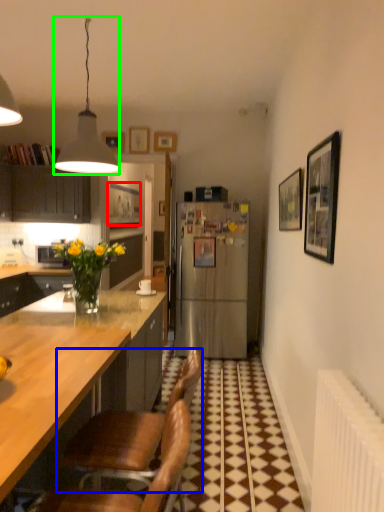
Question: Which object is the closest to the picture frame (highlighted by a red box)? Choose among these: chair (highlighted by a blue box) or lamp (highlighted by a green box).

Choices:
 (A) chair
 (B) lamp

Answer: (B)